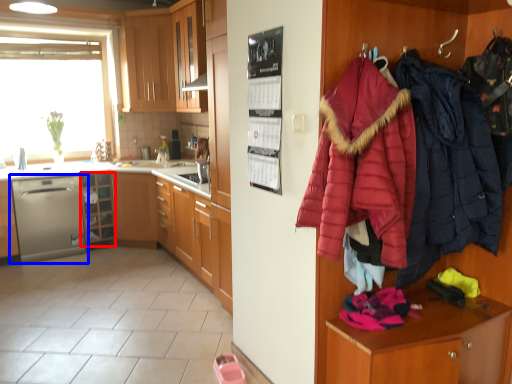
Question: Which point is further to the camera, shelf (highlighted by a red box) or dishwasher (highlighted by a blue box)?

Choices:
 (A) shelf
 (B) dishwasher

Answer: (A)